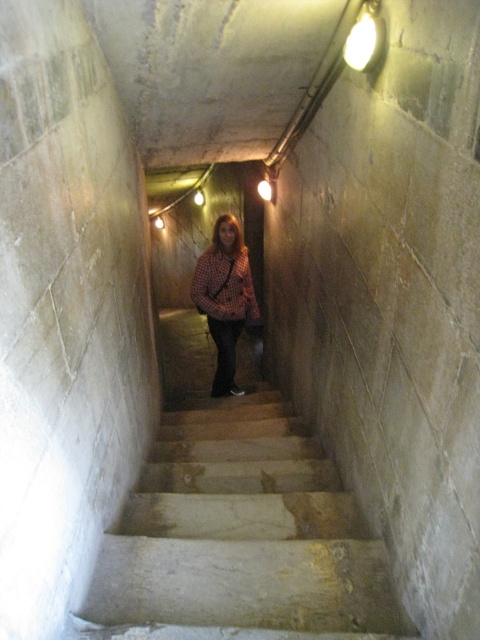
Which is above, concrete stairs at center or checkered fabric shirt at center?

checkered fabric shirt at center is higher up.

Identify the location of concrete stairs at center. The height and width of the screenshot is (640, 480). (240, 538).

At what (x,y) coordinates should I click in order to perform the action: click on concrete stairs at center. Please return your answer as a coordinate pair (x, y). The image size is (480, 640). Looking at the image, I should click on (240, 538).